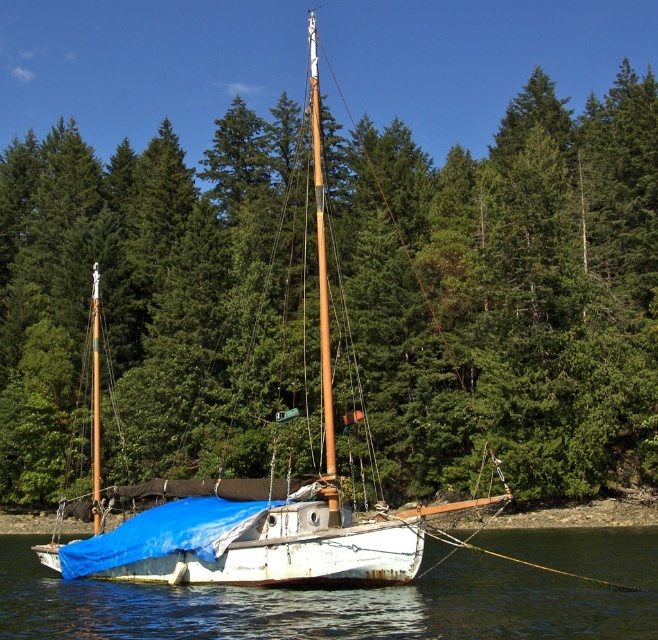
Is the position of white matte water at center less distant than that of white tarpaulin sailboat at center?

Yes, it is in front of white tarpaulin sailboat at center.

Is white matte water at center smaller than white tarpaulin sailboat at center?

Indeed, white matte water at center has a smaller size compared to white tarpaulin sailboat at center.

Describe the element at coordinates (361, 596) in the screenshot. I see `white matte water at center` at that location.

You are a GUI agent. You are given a task and a screenshot of the screen. Output one action in this format:
    pyautogui.click(x=<x>, y=<y>)
    Task: Click on the white matte water at center
    
    Given the screenshot: What is the action you would take?
    pyautogui.click(x=361, y=596)